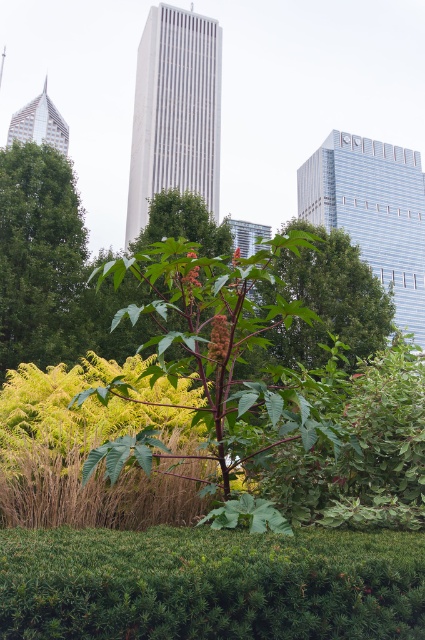
Question: Which of the following is the farthest from the observer?

Choices:
 (A) (337, 304)
 (B) (198, 282)
 (C) (79, 260)

Answer: (A)

Question: Among these objects, which one is nearest to the camera?

Choices:
 (A) green leafy tree at center
 (B) bright red matte flower at center
 (C) green leafy grass at center

Answer: (C)

Question: Which object is the closest to the green leafy grass at center?

Choices:
 (A) green leafy tree at left
 (B) glossy red flower at center

Answer: (B)

Question: Is green leafy grass at center wider than glossy red flower at center?

Choices:
 (A) no
 (B) yes

Answer: (B)

Question: Considering the relative positions of green leafy tree at left and glossy red flower at center in the image provided, where is green leafy tree at left located with respect to glossy red flower at center?

Choices:
 (A) right
 (B) left

Answer: (B)

Question: Does green leafy tree at left appear under glossy red flower at center?

Choices:
 (A) yes
 (B) no

Answer: (B)